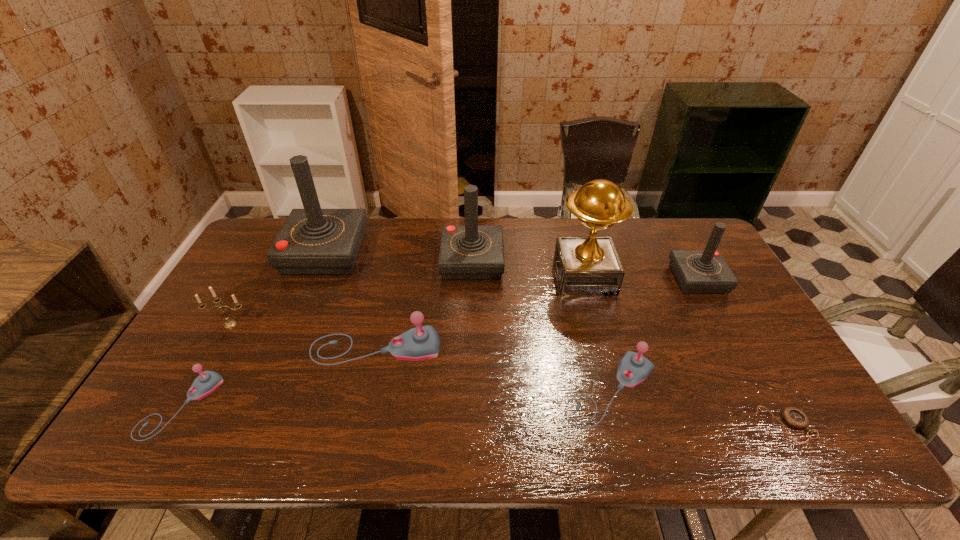
The width and height of the screenshot is (960, 540). In order to click on object that stands as the third closest to the biggest red joystick in this screenshot , I will do `click(467, 252)`.

I want to click on object that is the eighth closest to the fifth farthest object, so click(x=795, y=417).

Find the location of a particular element. This screenshot has height=540, width=960. joystick that is the third closest to the award is located at coordinates (633, 368).

Find the location of a particular element. Image resolution: width=960 pixels, height=540 pixels. joystick that is the second nearest to the second smallest red joystick is located at coordinates (313, 241).

Identify which red joystick is the closest to the seventh shortest object. Please provide its 2D coordinates. Your answer should be formatted as a tuple, i.e. [(x, y)], where the tuple contains the x and y coordinates of a point satisfying the conditions above.

[(313, 241)]

Choose which red joystick is the nearest neighbor to the pocket watch. Please provide its 2D coordinates. Your answer should be formatted as a tuple, i.e. [(x, y)], where the tuple contains the x and y coordinates of a point satisfying the conditions above.

[(705, 271)]

Locate which gray joystick is the closest to the shortest joystick. Please provide its 2D coordinates. Your answer should be formatted as a tuple, i.e. [(x, y)], where the tuple contains the x and y coordinates of a point satisfying the conditions above.

[(423, 342)]

Where is `gray joystick identified as the closest to the award`? gray joystick identified as the closest to the award is located at coordinates (633, 368).

The image size is (960, 540). What are the coordinates of `vacant position in the image that satisfies the following two spatial constraints: 1. on the rectangular base of the shortest object; 2. on the right side of the rightmost joystick` in the screenshot? It's located at [x=778, y=424].